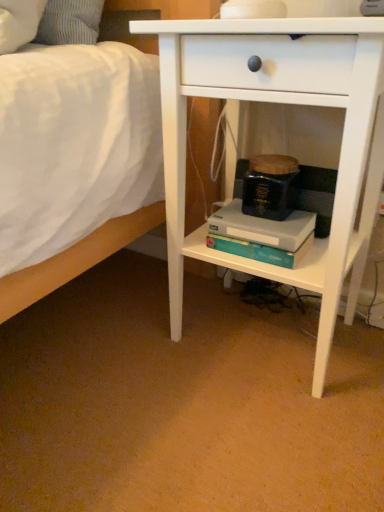
Question: Considering the relative sizes of teal matte paperback book at center, which is counted as the first paperback book, starting from the bottom, and white matte nightstand at center in the image provided, is teal matte paperback book at center, which is counted as the first paperback book, starting from the bottom, shorter than white matte nightstand at center?

Choices:
 (A) yes
 (B) no

Answer: (A)

Question: Is teal matte paperback book at center, which is counted as the first paperback book, starting from the bottom, outside of white matte nightstand at center?

Choices:
 (A) no
 (B) yes

Answer: (A)

Question: Does teal matte paperback book at center, which is counted as the first paperback book, starting from the bottom, have a lesser width compared to white matte nightstand at center?

Choices:
 (A) yes
 (B) no

Answer: (A)

Question: Does teal matte paperback book at center, the second paperback book viewed from the top, touch white matte nightstand at center?

Choices:
 (A) yes
 (B) no

Answer: (B)

Question: From the image's perspective, is teal matte paperback book at center, which is counted as the first paperback book, starting from the bottom, located above white matte nightstand at center?

Choices:
 (A) no
 (B) yes

Answer: (A)

Question: Which is correct: white matte nightstand at center is inside teal matte paperback book at center, which is counted as the 2th paperback book, starting from the bottom, or outside of it?

Choices:
 (A) outside
 (B) inside

Answer: (A)

Question: Is point (216, 97) positioned closer to the camera than point (291, 207)?

Choices:
 (A) closer
 (B) farther

Answer: (A)

Question: Looking at the image, does white matte nightstand at center seem bigger or smaller compared to teal matte paperback book at center, which is counted as the 2th paperback book, starting from the bottom?

Choices:
 (A) big
 (B) small

Answer: (A)

Question: Considering the relative positions of white matte nightstand at center and teal matte paperback book at center, which is counted as the 2th paperback book, starting from the bottom, in the image provided, is white matte nightstand at center to the left or to the right of teal matte paperback book at center, which is counted as the 2th paperback book, starting from the bottom,?

Choices:
 (A) right
 (B) left

Answer: (A)

Question: Considering the positions of teal matte paperback book at center, which is the 1th paperback book in top-to-bottom order, and white matte nightstand at center in the image, is teal matte paperback book at center, which is the 1th paperback book in top-to-bottom order, taller or shorter than white matte nightstand at center?

Choices:
 (A) short
 (B) tall

Answer: (A)

Question: Considering their positions, is teal matte paperback book at center, which is counted as the 2th paperback book, starting from the bottom, located in front of or behind white matte nightstand at center?

Choices:
 (A) behind
 (B) front

Answer: (A)

Question: From a real-world perspective, relative to white matte nightstand at center, is teal matte paperback book at center, which is counted as the 2th paperback book, starting from the bottom, vertically above or below?

Choices:
 (A) below
 (B) above

Answer: (B)

Question: In the image, is teal matte paperback book at center, which is the 1th paperback book in top-to-bottom order, on the left side or the right side of white matte nightstand at center?

Choices:
 (A) left
 (B) right

Answer: (A)

Question: Would you say white matte nightstand at center is to the left or to the right of teal matte paperback book at center, the second paperback book viewed from the top, in the picture?

Choices:
 (A) left
 (B) right

Answer: (B)

Question: Does point (357, 38) appear closer or farther from the camera than point (253, 227)?

Choices:
 (A) closer
 (B) farther

Answer: (A)